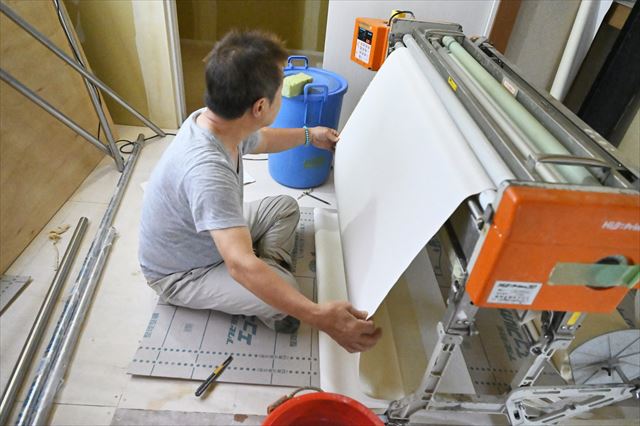
This screenshot has width=640, height=426. Identify the location of floor tile. (97, 307).